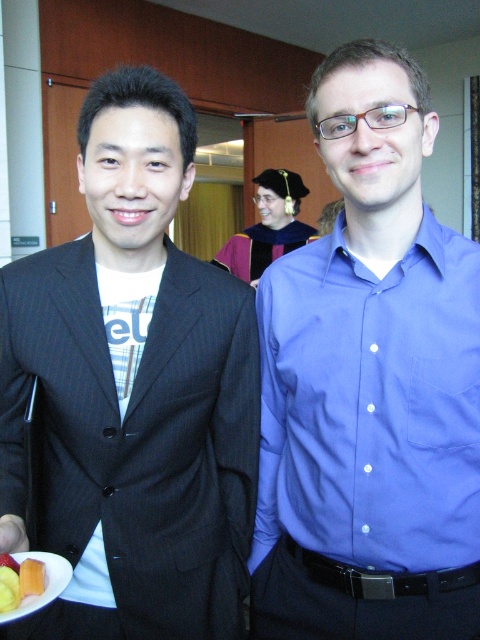
Does point (180, 195) come behind point (34, 560)?

Yes.

Is dark pinstripe suit at left taller than yellow gelatinous at lower left?

Yes, dark pinstripe suit at left is taller than yellow gelatinous at lower left.

At what (x,y) coordinates should I click in order to perform the action: click on dark pinstripe suit at left. Please return your answer as a coordinate pair (x, y). Image resolution: width=480 pixels, height=640 pixels. Looking at the image, I should click on (133, 388).

Between blue smooth shirt at center and maroon velvet graduation gown at center, which one is positioned higher?

Positioned higher is maroon velvet graduation gown at center.

The width and height of the screenshot is (480, 640). What do you see at coordinates (370, 385) in the screenshot? I see `blue smooth shirt at center` at bounding box center [370, 385].

The width and height of the screenshot is (480, 640). What do you see at coordinates (370, 385) in the screenshot?
I see `blue smooth shirt at center` at bounding box center [370, 385].

Identify the location of blue smooth shirt at center. (370, 385).

Who is lower down, dark pinstripe suit at left or white checkered shirt at center?

dark pinstripe suit at left is below.

Does point (213, 296) lie in front of point (156, 284)?

No.

Which is behind, point (240, 532) or point (126, 404)?

The point (240, 532) is more distant.

You are a GUI agent. You are given a task and a screenshot of the screen. Output one action in this format:
    pyautogui.click(x=<x>, y=<y>)
    Task: Click on the dark pinstripe suit at left
    The image size is (480, 640).
    Given the screenshot: What is the action you would take?
    pyautogui.click(x=133, y=388)